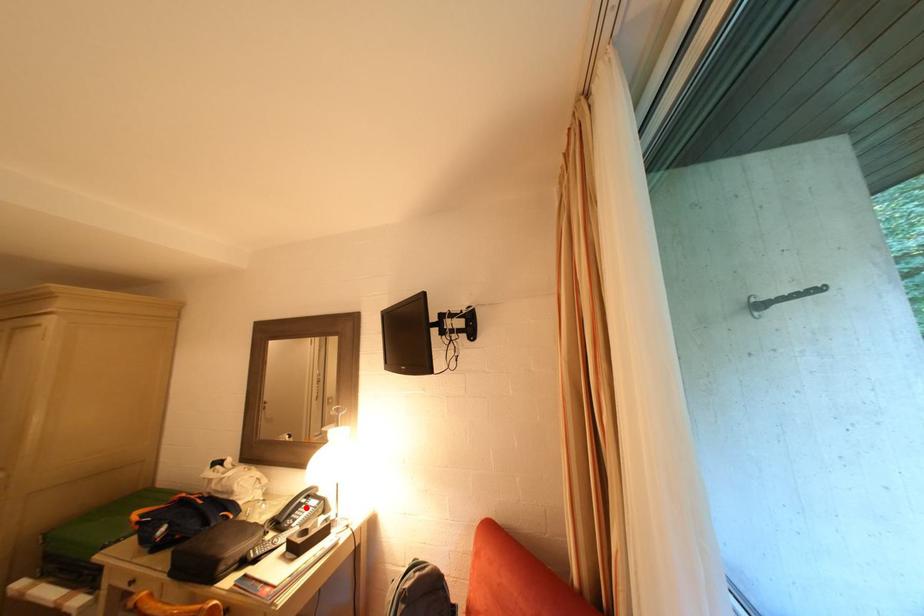
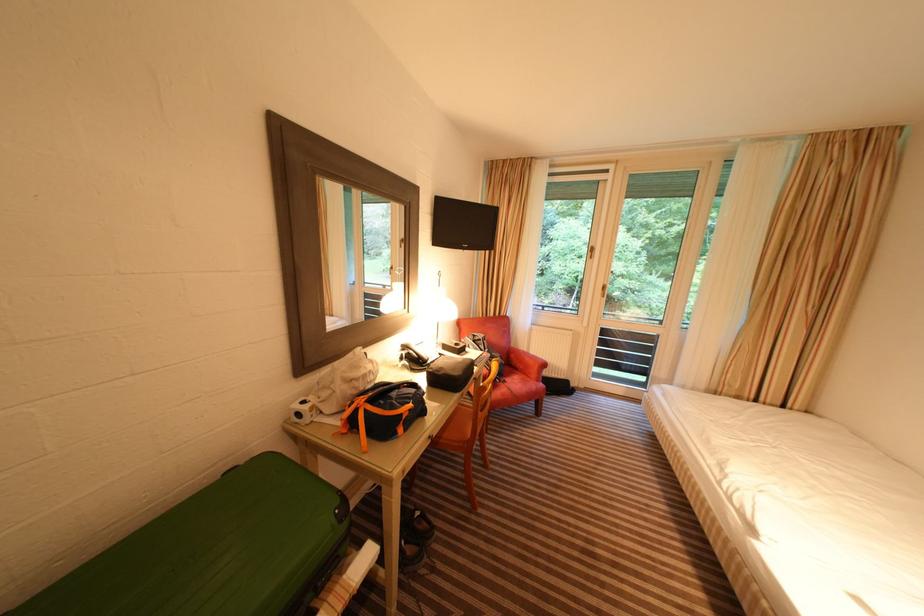
Where in the second image is the point corresponding to the highlighted location from the first image?

(423, 355)